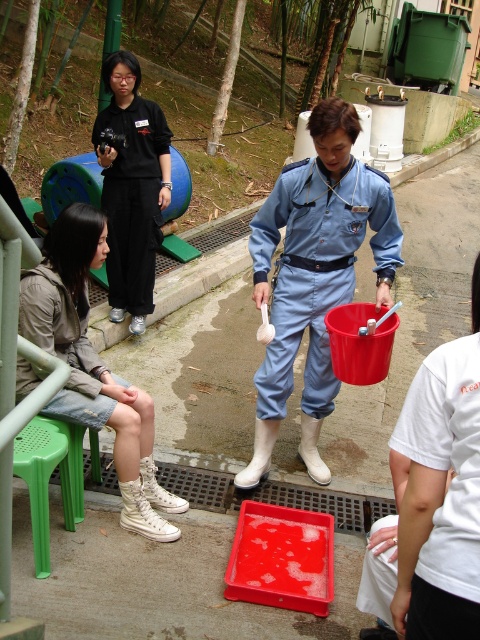
Is denim jacket at lower left bigger than green plastic stool at lower left?

Yes, denim jacket at lower left is bigger than green plastic stool at lower left.

Does denim jacket at lower left appear over green plastic stool at lower left?

Indeed, denim jacket at lower left is positioned over green plastic stool at lower left.

What do you see at coordinates (63, 344) in the screenshot? I see `denim jacket at lower left` at bounding box center [63, 344].

I want to click on denim jacket at lower left, so click(63, 344).

Does matte blue jumpsuit at center have a lesser width compared to black matte uniform at upper left?

Incorrect, matte blue jumpsuit at center's width is not less than black matte uniform at upper left's.

Does matte blue jumpsuit at center appear over black matte uniform at upper left?

No, matte blue jumpsuit at center is not above black matte uniform at upper left.

What do you see at coordinates (315, 269) in the screenshot? I see `matte blue jumpsuit at center` at bounding box center [315, 269].

You are a GUI agent. You are given a task and a screenshot of the screen. Output one action in this format:
    pyautogui.click(x=<x>, y=<y>)
    Task: Click on the matte blue jumpsuit at center
    
    Given the screenshot: What is the action you would take?
    pyautogui.click(x=315, y=269)

Is point (388, 224) behind point (31, 516)?

Yes.

Does matte blue jumpsuit at center appear on the left side of green plastic stool at lower left?

Incorrect, matte blue jumpsuit at center is not on the left side of green plastic stool at lower left.

Who is more distant from viewer, (x=282, y=257) or (x=40, y=480)?

The point (x=282, y=257) is behind.

You are a GUI agent. You are given a task and a screenshot of the screen. Output one action in this format:
    pyautogui.click(x=<x>, y=<y>)
    Task: Click on the matte blue jumpsuit at center
    The width and height of the screenshot is (480, 640).
    Given the screenshot: What is the action you would take?
    pyautogui.click(x=315, y=269)